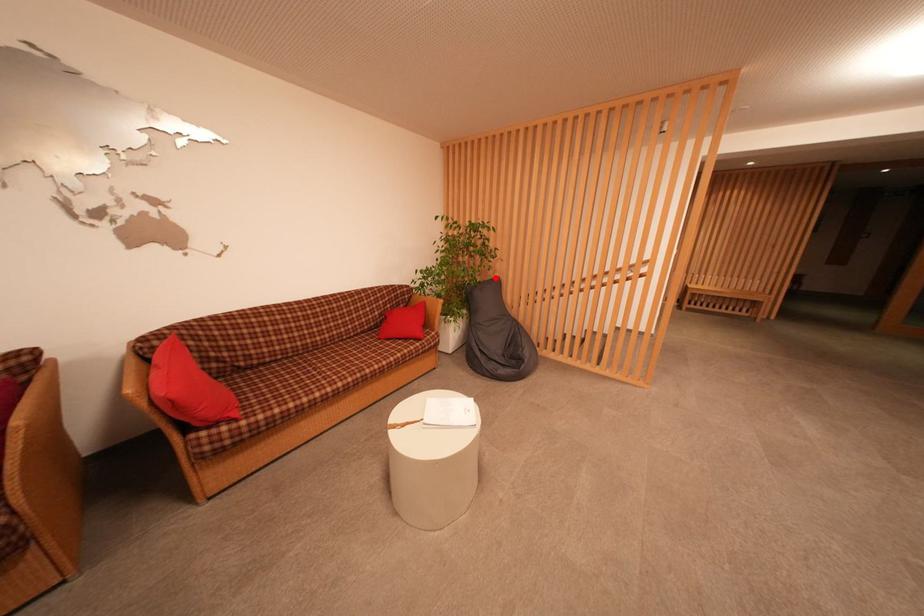
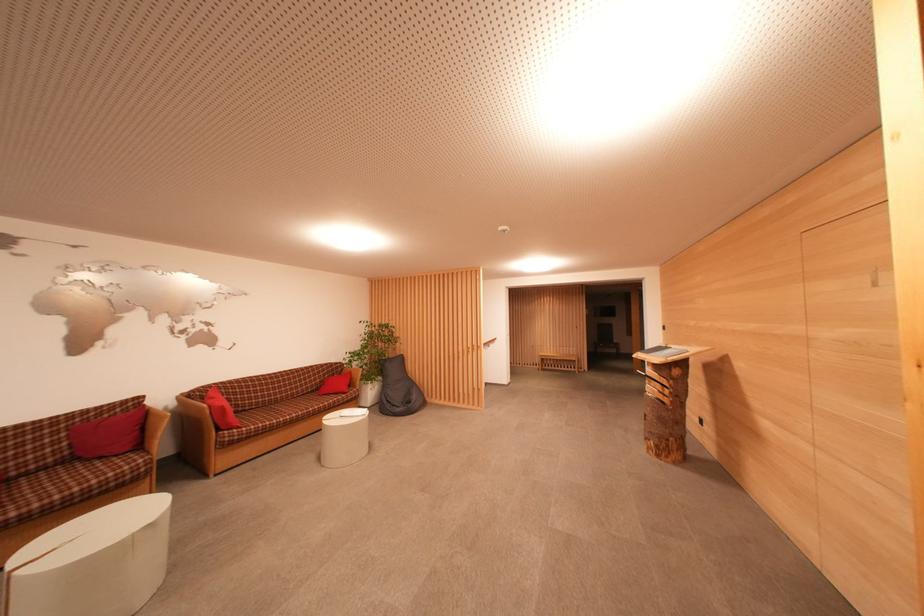
In the second image, find the point that corresponds to the highlighted location in the first image.

(402, 357)